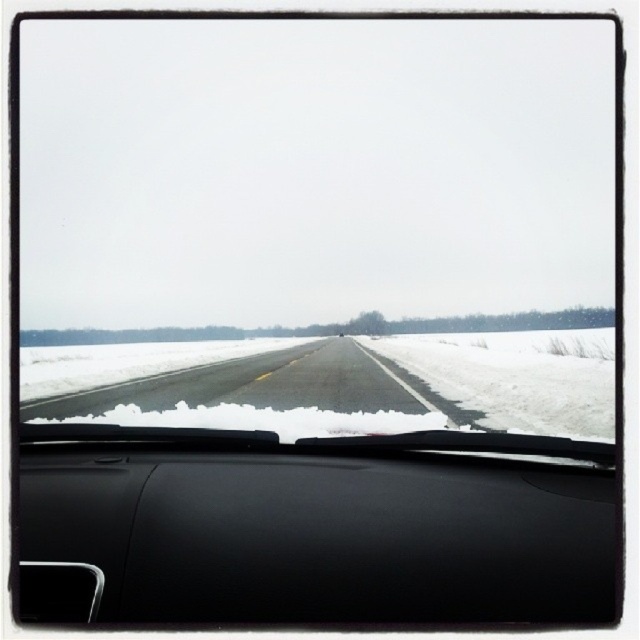
You are driving a car with a trunk length of 1.2 meters. You notice a point on the road ahead at coordinates point (557, 560). Can your car safely pass this point without hitting anything, considering the trunk length?

The point (557, 560) is 12.13 meters away from the viewer. Since the car trunk is only 1.2 meters long, there is ample space to safely pass the point without any collision.

You are a passenger in the car and want to check the dashboard while looking at the road ahead. Can you see the black matte dashboard at center without turning your head away from the black asphalt highway at center?

The black matte dashboard at center is to the right of the black asphalt highway at center, so you can see it by glancing slightly to the right while keeping your gaze mostly on the road ahead.

You are a passenger in the car and want to check the dashboard while looking at the road ahead. Is the black matte dashboard at center located above the black asphalt highway at center?

Yes, the black matte dashboard at center is positioned above the black asphalt highway at center, so you can check the dashboard without taking your eyes off the road ahead.